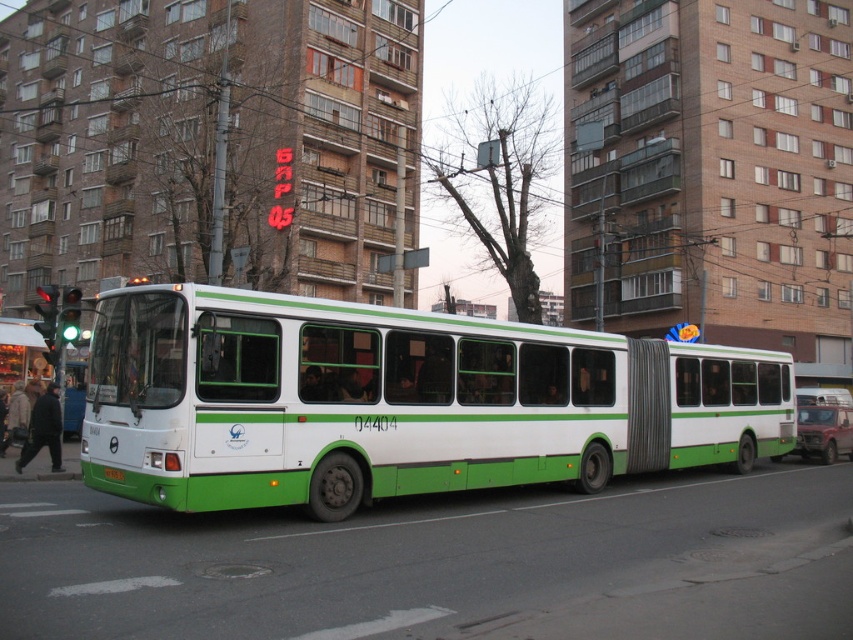
Is point (26, 324) closer to viewer compared to point (120, 468)?

No, (26, 324) is further to viewer.

Does green rubber bus stop at left have a lesser width compared to green matte license plate at center?

In fact, green rubber bus stop at left might be wider than green matte license plate at center.

Is point (74, 387) closer to camera compared to point (107, 468)?

No, it is not.

The image size is (853, 640). What are the coordinates of `green rubber bus stop at left` in the screenshot? It's located at (21, 353).

Is green matte bus at center taller than green matte license plate at center?

Yes.

What do you see at coordinates (397, 401) in the screenshot?
I see `green matte bus at center` at bounding box center [397, 401].

The height and width of the screenshot is (640, 853). I want to click on green matte bus at center, so click(397, 401).

Find the location of `green matte bus at center`. green matte bus at center is located at coordinates (397, 401).

Can you confirm if green matte bus at center is shorter than green rubber bus stop at left?

No, green matte bus at center is not shorter than green rubber bus stop at left.

Who is higher up, green matte bus at center or green rubber bus stop at left?

green rubber bus stop at left is above.

This screenshot has width=853, height=640. What do you see at coordinates (397, 401) in the screenshot?
I see `green matte bus at center` at bounding box center [397, 401].

You are a GUI agent. You are given a task and a screenshot of the screen. Output one action in this format:
    pyautogui.click(x=<x>, y=<y>)
    Task: Click on the green matte bus at center
    The height and width of the screenshot is (640, 853).
    Given the screenshot: What is the action you would take?
    pyautogui.click(x=397, y=401)